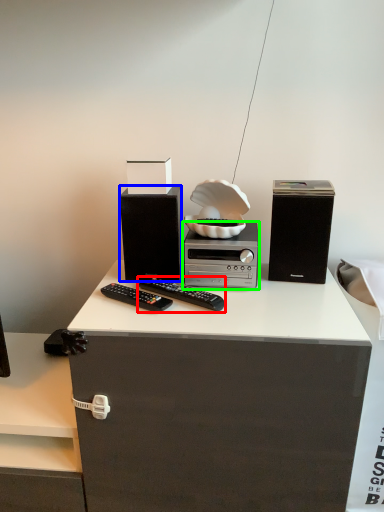
Question: Which object is the closest to the remote control (highlighted by a red box)? Choose among these: speaker (highlighted by a blue box) or home appliance (highlighted by a green box).

Choices:
 (A) speaker
 (B) home appliance

Answer: (B)